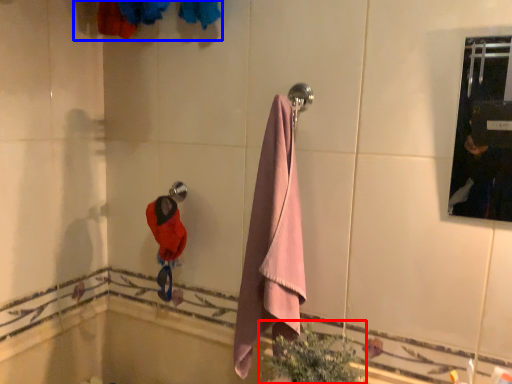
Question: Which of the following is the farthest to the observer, plant (highlighted by a red box) or laundry (highlighted by a blue box)?

Choices:
 (A) plant
 (B) laundry

Answer: (A)